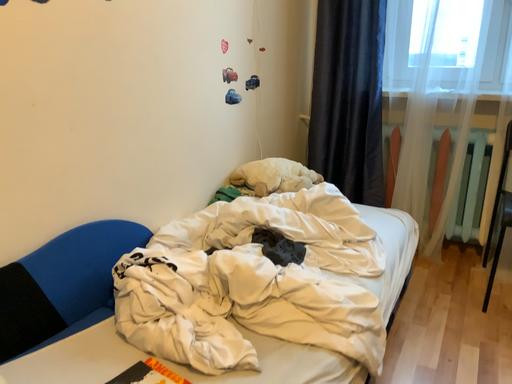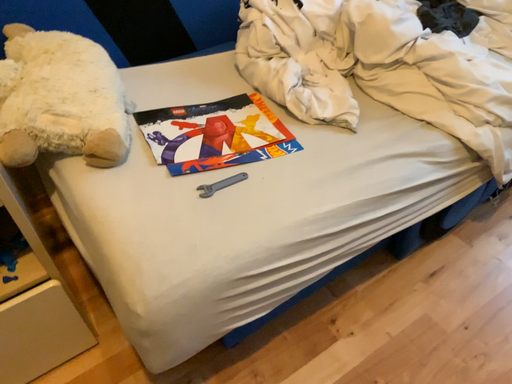
Question: Which way did the camera rotate in the video?

Choices:
 (A) rotated right
 (B) rotated left

Answer: (B)